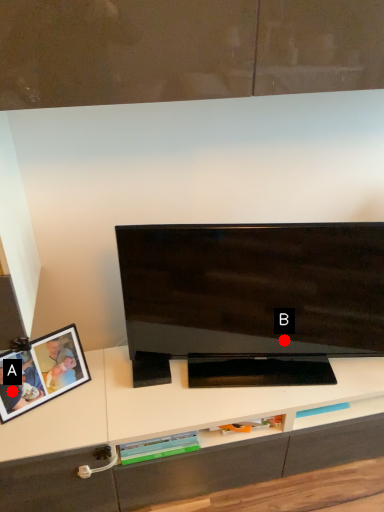
Question: Two points are circled on the image, labeled by A and B beside each circle. Which point is closer to the camera?

Choices:
 (A) A is closer
 (B) B is closer

Answer: (A)